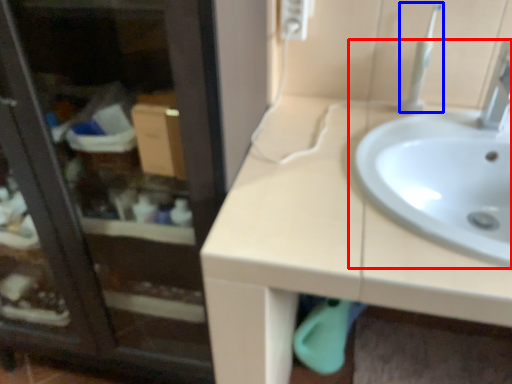
Question: Among these objects, which one is nearest to the camera, sink (highlighted by a red box) or toothbrush (highlighted by a blue box)?

Choices:
 (A) sink
 (B) toothbrush

Answer: (A)